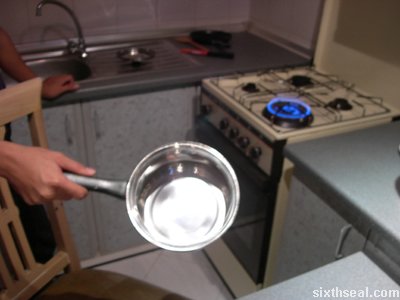
Find the location of a particular element. hot burner you should not touch is located at coordinates (291, 111).